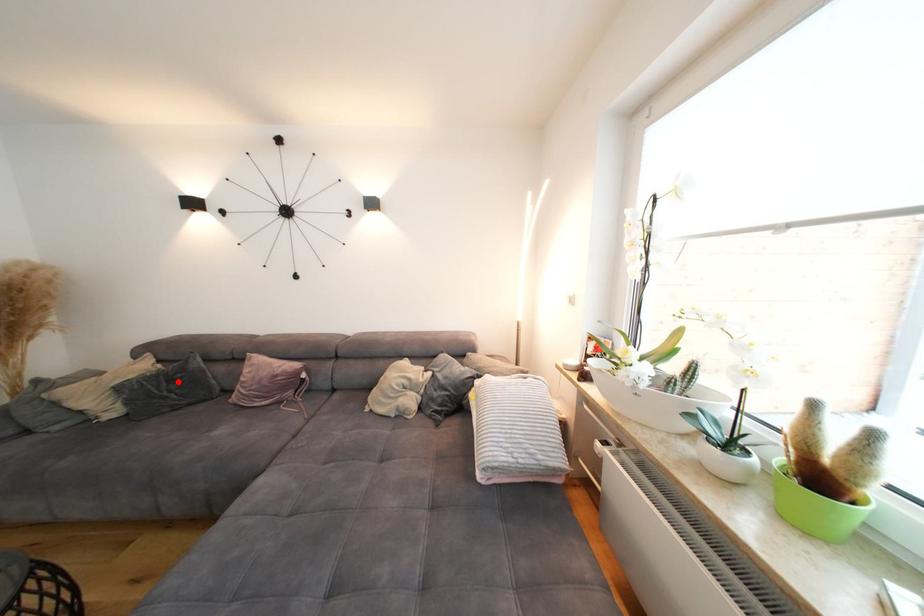
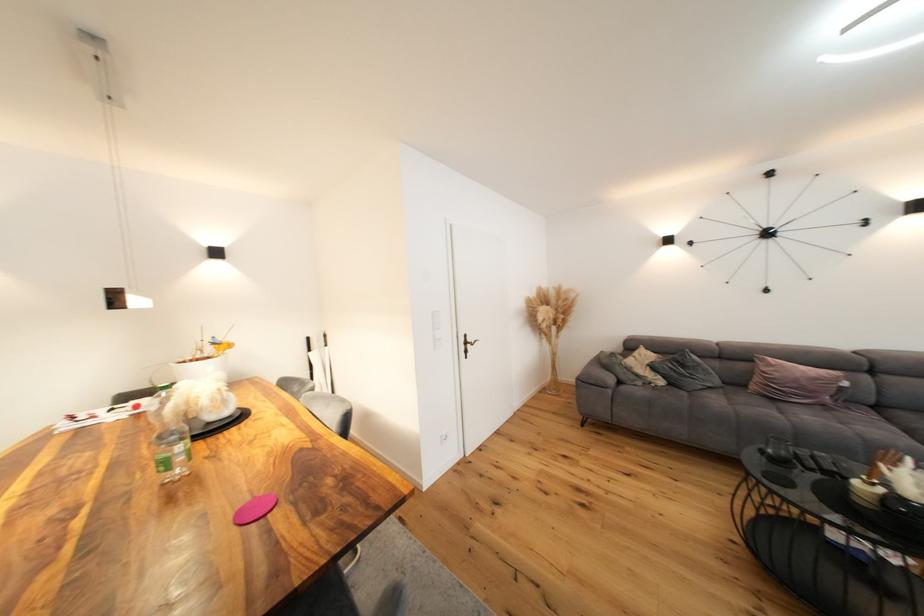
Find the pixel in the second image that matches the highlighted location in the first image.

(690, 368)